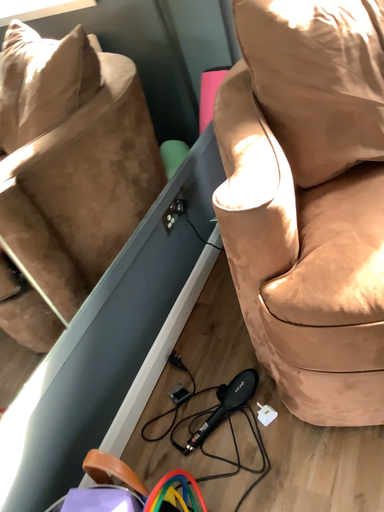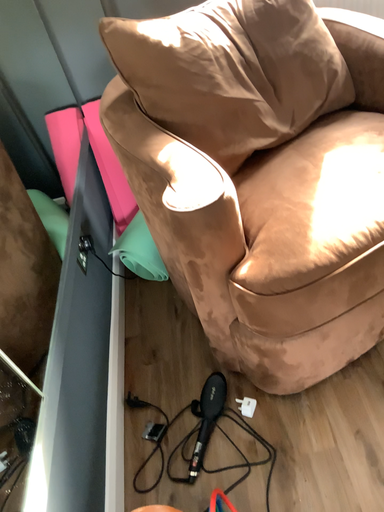
Question: Which way did the camera rotate in the video?

Choices:
 (A) rotated upward
 (B) rotated downward

Answer: (A)